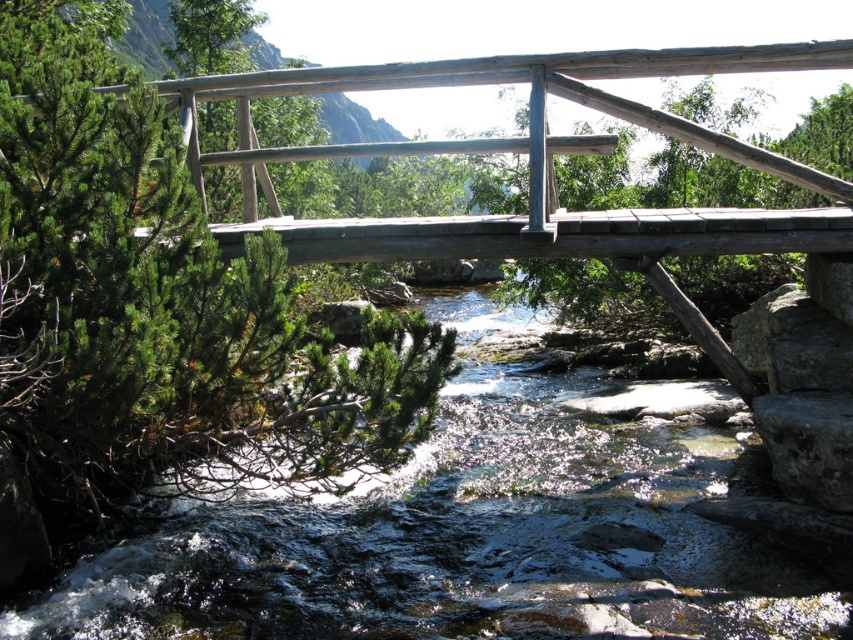
You are a hiker who wants to cross the natural wood bridge at center to reach the other side. However, you notice the clear water at center below the bridge. Considering the width of the bridge and the water, which one is wider?

The clear water at center is wider than the natural wood bridge at center, so the water is wider.

You are a hiker who wants to cross the stream using the bridge. Based on the scene, can you determine if the clear water at center is lower than the natural wood bridge at center?

The clear water at center has a lesser height compared to natural wood bridge at center, so yes, the clear water at center is lower than the natural wood bridge at center.

Consider the image. You are a hiker who wants to cross the natural wood bridge at center to reach the other side. However, you notice the clear water at center flowing underneath. Is the bridge positioned above the water so you can safely cross without getting your feet wet?

The clear water at center is below the natural wood bridge at center, so yes, the bridge is positioned above the water, allowing safe passage without getting your feet wet.